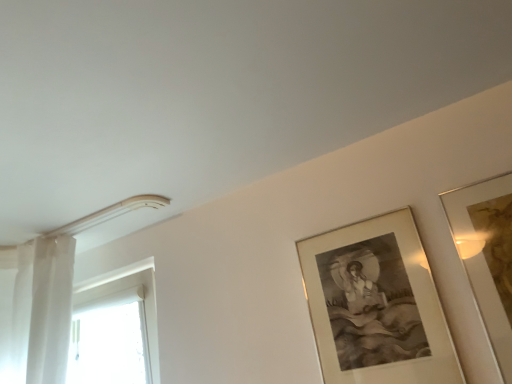
Question: From their relative heights in the image, would you say gold metallic picture frame at upper right, marked as the 1th picture frame in a right-to-left arrangement, is taller or shorter than white glossy door at left?

Choices:
 (A) tall
 (B) short

Answer: (A)

Question: Is point (505, 185) positioned closer to the camera than point (143, 352)?

Choices:
 (A) farther
 (B) closer

Answer: (B)

Question: Based on their relative distances, which object is nearer to the gold metallic picture frame at upper right, marked as the 1th picture frame in a right-to-left arrangement?

Choices:
 (A) gold-framed artwork at upper right, arranged as the 2th picture frame when viewed from the right
 (B) white glossy door at left

Answer: (A)

Question: Estimate the real-world distances between objects in this image. Which object is closer to the white glossy door at left?

Choices:
 (A) gold-framed artwork at upper right, arranged as the 2th picture frame when viewed from the right
 (B) gold metallic picture frame at upper right, marked as the 1th picture frame in a right-to-left arrangement

Answer: (A)